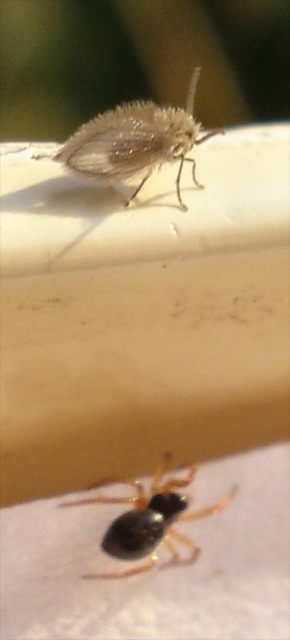
Question: Is translucent fuzzy fly at upper center to the right of black glossy spider at lower center from the viewer's perspective?

Choices:
 (A) yes
 (B) no

Answer: (B)

Question: Can you confirm if translucent fuzzy fly at upper center is positioned to the right of black glossy spider at lower center?

Choices:
 (A) no
 (B) yes

Answer: (A)

Question: Where is translucent fuzzy fly at upper center located in relation to black glossy spider at lower center in the image?

Choices:
 (A) below
 (B) above

Answer: (B)

Question: Which object appears farthest from the camera in this image?

Choices:
 (A) black glossy spider at lower center
 (B) translucent fuzzy fly at upper center

Answer: (A)